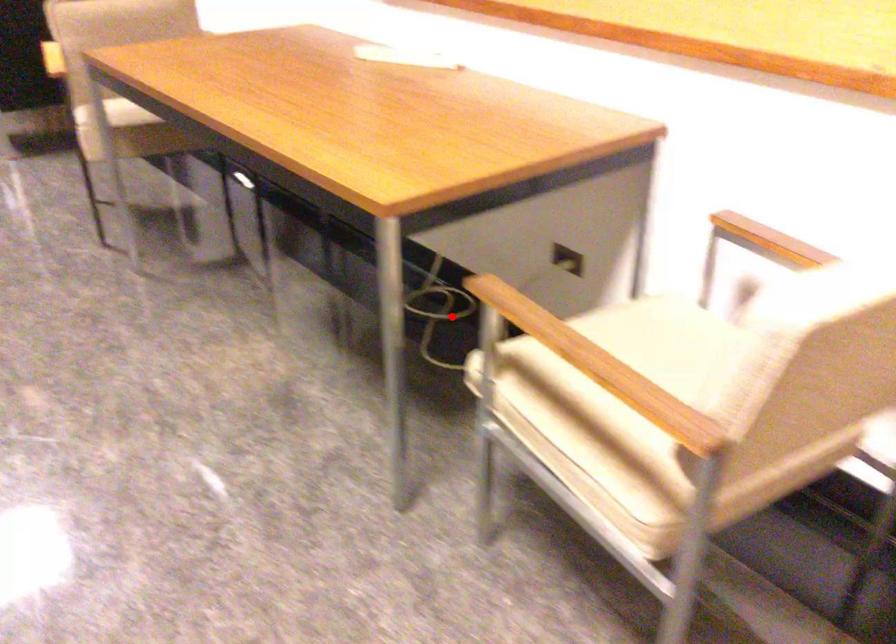
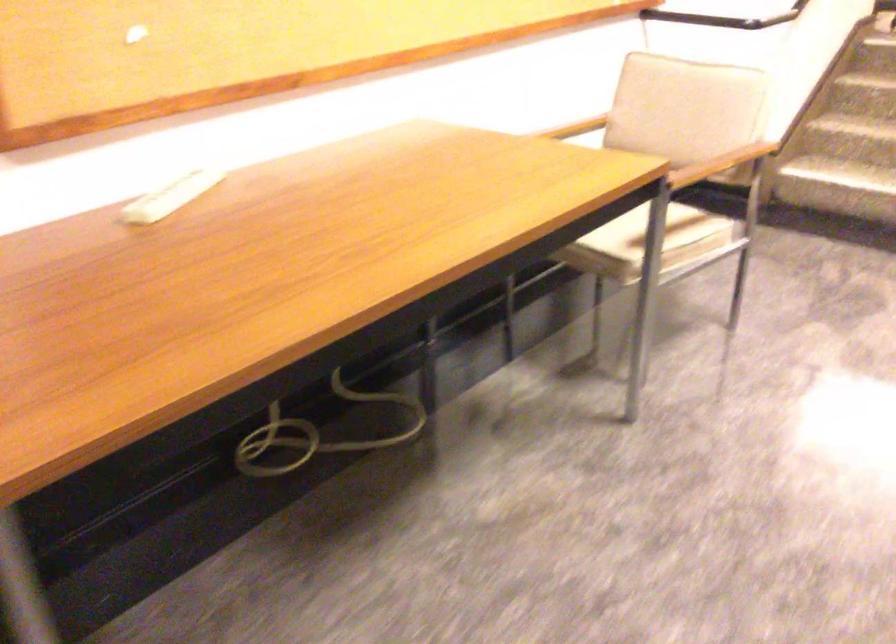
Find the pixel in the second image that matches the highlighted location in the first image.

(317, 433)